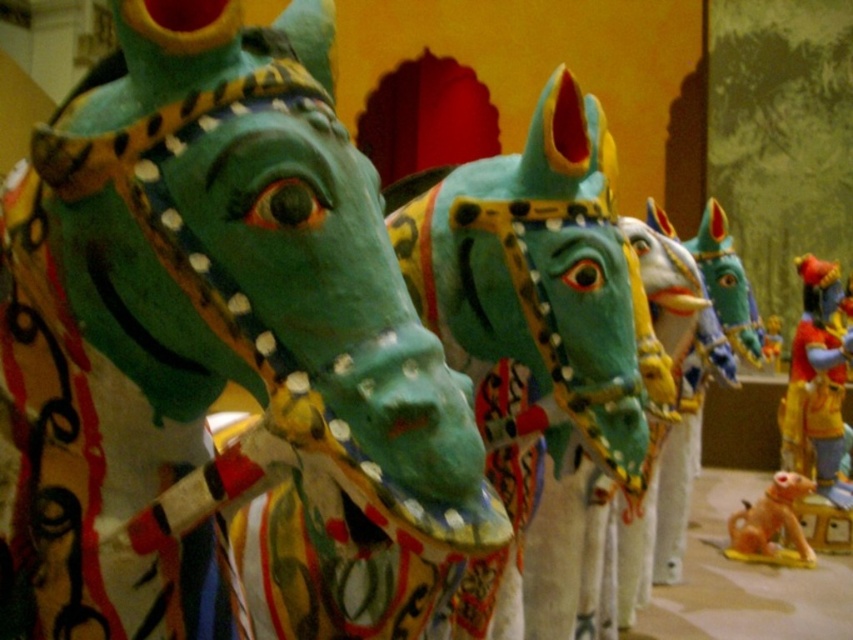
Does matte green horse at center have a larger size compared to shiny red and gold figure at right?

Actually, matte green horse at center might be smaller than shiny red and gold figure at right.

Does matte green horse at center have a greater width compared to shiny red and gold figure at right?

Yes.

Is point (437, 481) positioned in front of point (786, 400)?

Yes, point (437, 481) is in front of point (786, 400).

Locate an element on the screen. matte green horse at center is located at coordinates (204, 330).

In the scene shown: Between shiny red and gold figure at right and orange matte dog at lower right, which one has less height?

orange matte dog at lower right is shorter.

Is point (846, 442) positioned behind point (778, 518)?

Yes, point (846, 442) is behind point (778, 518).

The width and height of the screenshot is (853, 640). Find the location of `shiny red and gold figure at right`. shiny red and gold figure at right is located at coordinates (817, 380).

Can you confirm if matte green horse at center is smaller than orange matte dog at lower right?

Actually, matte green horse at center might be larger than orange matte dog at lower right.

Does point (91, 337) lie in front of point (782, 496)?

Yes, it is in front of point (782, 496).

Is point (209, 49) in front of point (807, 484)?

Yes, it is in front of point (807, 484).

The width and height of the screenshot is (853, 640). What are the coordinates of `matte green horse at center` in the screenshot? It's located at (204, 330).